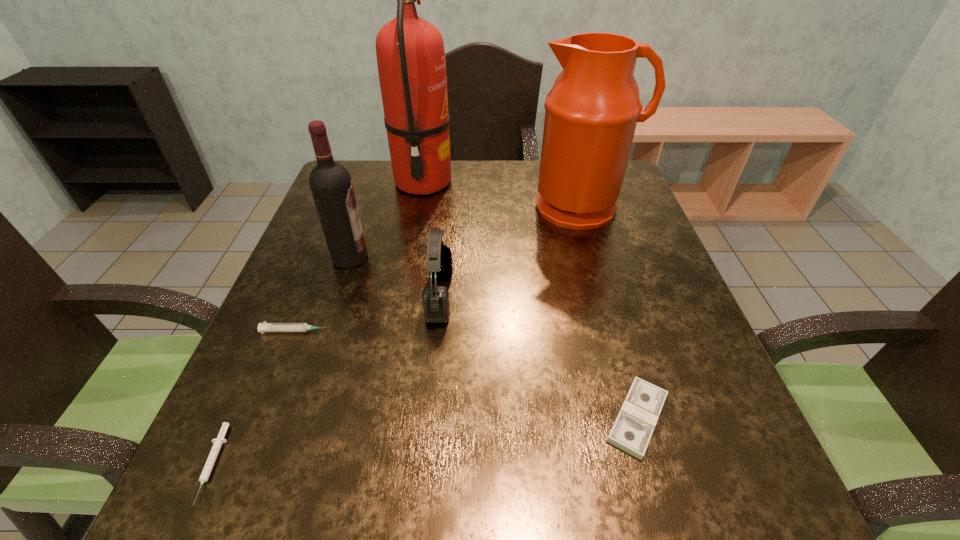
This screenshot has width=960, height=540. What are the coordinates of `fire extinguisher` in the screenshot? It's located at (410, 52).

Image resolution: width=960 pixels, height=540 pixels. In order to click on the second tallest object in this screenshot , I will do `click(591, 112)`.

What are the coordinates of `wine bottle` in the screenshot? It's located at (331, 185).

This screenshot has width=960, height=540. Identify the location of headset. (x=435, y=298).

You are a GUI agent. You are given a task and a screenshot of the screen. Output one action in this format:
    pyautogui.click(x=<x>, y=<y>)
    Task: Click on the farther syringe
    
    Given the screenshot: What is the action you would take?
    pyautogui.click(x=263, y=327)

The image size is (960, 540). Identify the location of the taller syringe. (263, 327).

The image size is (960, 540). I want to click on dollar, so click(x=632, y=430).

The height and width of the screenshot is (540, 960). In order to click on the nearer syringe in this screenshot , I will do `click(218, 442)`.

Where is `vacant space located on the side of the tallest object with the nozzle and handle`? vacant space located on the side of the tallest object with the nozzle and handle is located at coordinates (542, 182).

Where is `free space located from the spout of the sixth shortest object`? The image size is (960, 540). free space located from the spout of the sixth shortest object is located at coordinates (605, 284).